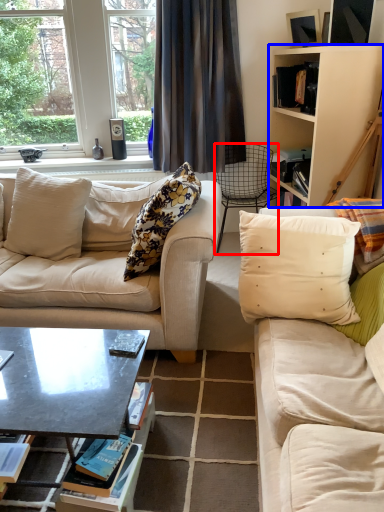
Question: Which object appears farthest to the camera in this image, chair (highlighted by a red box) or cabinetry (highlighted by a blue box)?

Choices:
 (A) chair
 (B) cabinetry

Answer: (A)